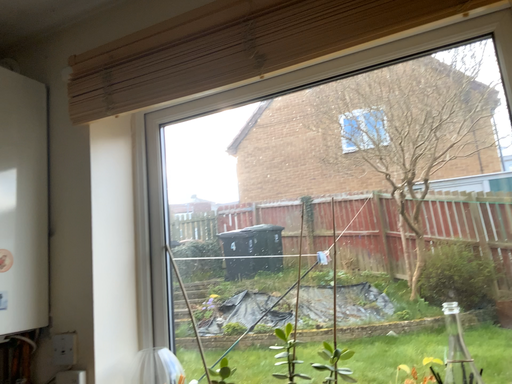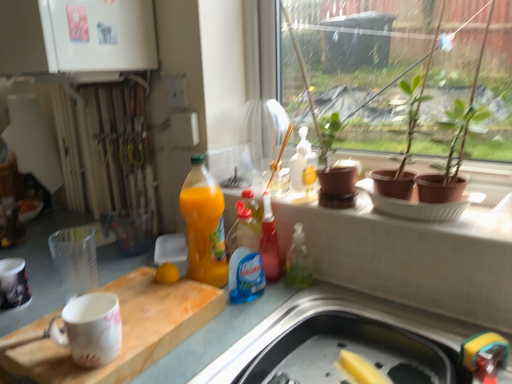
Question: Which way did the camera rotate in the video?

Choices:
 (A) rotated right
 (B) rotated left

Answer: (B)